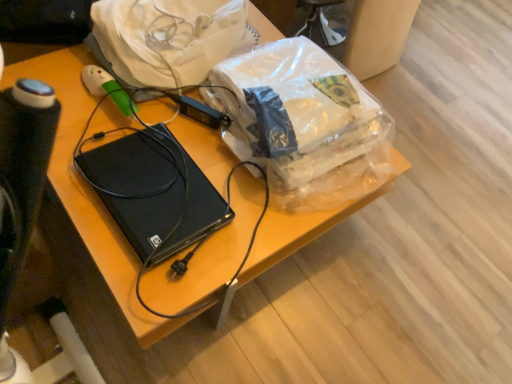
Question: From a real-world perspective, is white plastic bag at upper center under translucent plastic bag at center?

Choices:
 (A) yes
 (B) no

Answer: (B)

Question: Is white plastic bag at upper center to the left of translucent plastic bag at center from the viewer's perspective?

Choices:
 (A) no
 (B) yes

Answer: (B)

Question: Can you confirm if white plastic bag at upper center is smaller than translucent plastic bag at center?

Choices:
 (A) yes
 (B) no

Answer: (B)

Question: Would you say translucent plastic bag at center is part of white plastic bag at upper center's contents?

Choices:
 (A) yes
 (B) no

Answer: (B)

Question: Considering the relative sizes of white plastic bag at upper center and translucent plastic bag at center in the image provided, is white plastic bag at upper center bigger than translucent plastic bag at center?

Choices:
 (A) no
 (B) yes

Answer: (B)

Question: Visually, is white plastic bag at upper center positioned to the left or to the right of black plastic computer at center?

Choices:
 (A) right
 (B) left

Answer: (A)

Question: In terms of height, does white plastic bag at upper center look taller or shorter compared to black plastic computer at center?

Choices:
 (A) short
 (B) tall

Answer: (B)

Question: From a real-world perspective, relative to black plastic computer at center, is white plastic bag at upper center vertically above or below?

Choices:
 (A) above
 (B) below

Answer: (A)

Question: Is point (201, 24) closer or farther from the camera than point (230, 213)?

Choices:
 (A) farther
 (B) closer

Answer: (A)

Question: Considering the positions of black plastic computer at center and translucent plastic bag at center in the image, is black plastic computer at center bigger or smaller than translucent plastic bag at center?

Choices:
 (A) small
 (B) big

Answer: (A)

Question: Is black plastic computer at center in front of or behind translucent plastic bag at center in the image?

Choices:
 (A) front
 (B) behind

Answer: (A)

Question: Is black plastic computer at center wider or thinner than translucent plastic bag at center?

Choices:
 (A) wide
 (B) thin

Answer: (B)

Question: From a real-world perspective, relative to translucent plastic bag at center, is black plastic computer at center vertically above or below?

Choices:
 (A) above
 (B) below

Answer: (B)

Question: In terms of size, does translucent plastic bag at center appear bigger or smaller than white plastic bag at upper center?

Choices:
 (A) small
 (B) big

Answer: (A)

Question: Does point (365, 117) appear closer or farther from the camera than point (166, 28)?

Choices:
 (A) closer
 (B) farther

Answer: (A)